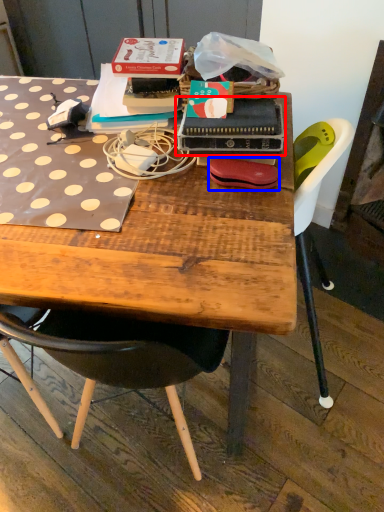
Question: Which object appears farthest to the camera in this image, paperback book (highlighted by a red box) or handbag (highlighted by a blue box)?

Choices:
 (A) paperback book
 (B) handbag

Answer: (B)